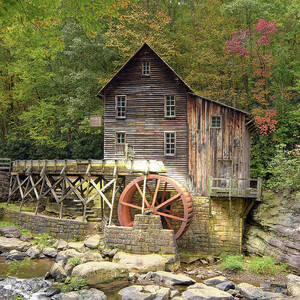
I want to click on front door, so click(119, 141).